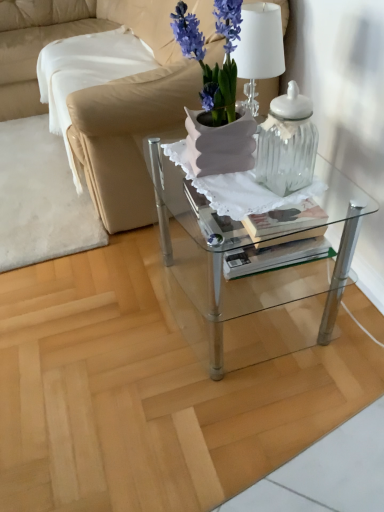
Question: Is clear glass table at center to the left or to the right of purple matte vase at center in the image?

Choices:
 (A) left
 (B) right

Answer: (B)

Question: Is clear glass table at center taller or shorter than purple matte vase at center?

Choices:
 (A) tall
 (B) short

Answer: (A)

Question: Which object is positioned farthest from the clear glass jar at center?

Choices:
 (A) beige leather couch at upper left
 (B) clear glass table at center
 (C) purple matte vase at center

Answer: (A)

Question: Which is nearer to the clear glass table at center?

Choices:
 (A) clear glass jar at center
 (B) beige leather couch at upper left
 (C) purple matte vase at center

Answer: (C)